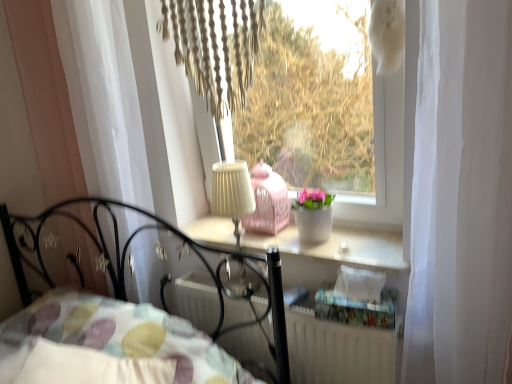
Question: Should I look upward or downward to see beige fabric lampshade at center?

Choices:
 (A) up
 (B) down

Answer: (B)

Question: Is white matte window at center facing away from beige fabric lampshade at center?

Choices:
 (A) yes
 (B) no

Answer: (B)

Question: From the image's perspective, does white matte window at center appear lower than beige fabric lampshade at center?

Choices:
 (A) no
 (B) yes

Answer: (A)

Question: Can you confirm if white matte window at center is positioned to the left of beige fabric lampshade at center?

Choices:
 (A) no
 (B) yes

Answer: (A)

Question: Does white matte window at center appear on the right side of beige fabric lampshade at center?

Choices:
 (A) yes
 (B) no

Answer: (A)

Question: From a real-world perspective, does white matte window at center stand above beige fabric lampshade at center?

Choices:
 (A) no
 (B) yes

Answer: (B)

Question: Is white matte window at center completely or partially outside of beige fabric lampshade at center?

Choices:
 (A) yes
 (B) no

Answer: (A)

Question: Is white sheer curtain at left smaller than white matte window at center?

Choices:
 (A) no
 (B) yes

Answer: (B)

Question: From a real-world perspective, is white sheer curtain at left beneath white matte window at center?

Choices:
 (A) yes
 (B) no

Answer: (A)

Question: Is white sheer curtain at left to the left of white matte window at center from the viewer's perspective?

Choices:
 (A) yes
 (B) no

Answer: (A)

Question: Considering the relative sizes of white sheer curtain at left and white matte window at center in the image provided, is white sheer curtain at left taller than white matte window at center?

Choices:
 (A) no
 (B) yes

Answer: (B)

Question: Considering the relative positions of white sheer curtain at left and white matte window at center in the image provided, is white sheer curtain at left to the right of white matte window at center from the viewer's perspective?

Choices:
 (A) yes
 (B) no

Answer: (B)

Question: From the image's perspective, does white sheer curtain at left appear higher than white matte window at center?

Choices:
 (A) no
 (B) yes

Answer: (A)

Question: From the image's perspective, is white sheer curtain at left above white textured radiator at lower center?

Choices:
 (A) no
 (B) yes

Answer: (B)